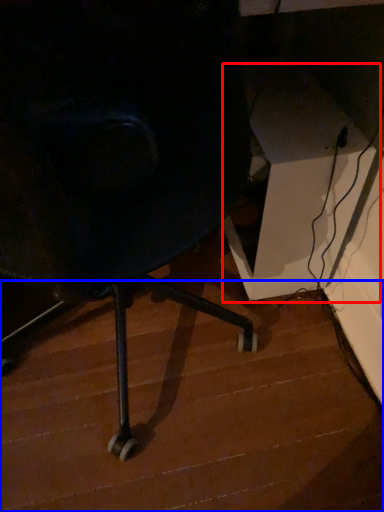
Question: Which point is further to the camera, table (highlighted by a red box) or stair (highlighted by a blue box)?

Choices:
 (A) table
 (B) stair

Answer: (A)